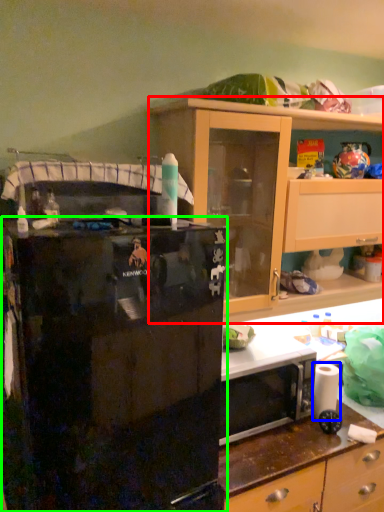
Question: Which object is the farthest from cabinetry (highlighted by a red box)? Choose among these: toilet paper (highlighted by a blue box) or refrigerator (highlighted by a green box).

Choices:
 (A) toilet paper
 (B) refrigerator

Answer: (A)